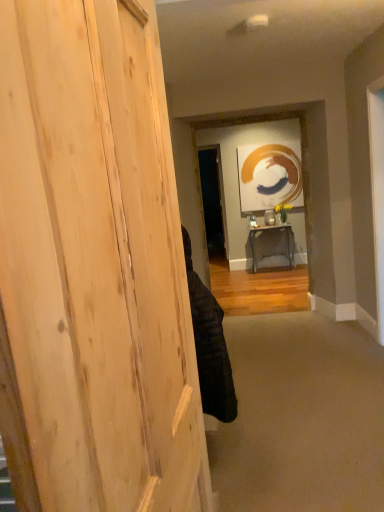
Question: Considering the relative positions of beige carpet at lower center and natural wood door at left in the image provided, is beige carpet at lower center to the right of natural wood door at left from the viewer's perspective?

Choices:
 (A) yes
 (B) no

Answer: (A)

Question: Is natural wood door at left a part of beige carpet at lower center?

Choices:
 (A) no
 (B) yes

Answer: (A)

Question: Is beige carpet at lower center completely or partially outside of natural wood door at left?

Choices:
 (A) no
 (B) yes

Answer: (B)

Question: From the image's perspective, would you say beige carpet at lower center is positioned over natural wood door at left?

Choices:
 (A) no
 (B) yes

Answer: (A)

Question: Is there a large distance between beige carpet at lower center and natural wood door at left?

Choices:
 (A) yes
 (B) no

Answer: (A)

Question: Considering the relative sizes of beige carpet at lower center and natural wood door at left in the image provided, is beige carpet at lower center thinner than natural wood door at left?

Choices:
 (A) no
 (B) yes

Answer: (A)

Question: Is black fabric at center at the back of wooden table at center?

Choices:
 (A) no
 (B) yes

Answer: (A)

Question: Does wooden table at center lie in front of black fabric at center?

Choices:
 (A) yes
 (B) no

Answer: (B)

Question: Does wooden table at center have a greater height compared to black fabric at center?

Choices:
 (A) no
 (B) yes

Answer: (A)

Question: Is wooden table at center not within black fabric at center?

Choices:
 (A) yes
 (B) no

Answer: (A)

Question: Can black fabric at center be found inside wooden table at center?

Choices:
 (A) yes
 (B) no

Answer: (B)

Question: Does wooden table at center turn towards black fabric at center?

Choices:
 (A) no
 (B) yes

Answer: (B)

Question: Is the position of black fabric at center more distant than that of beige carpet at lower center?

Choices:
 (A) no
 (B) yes

Answer: (B)